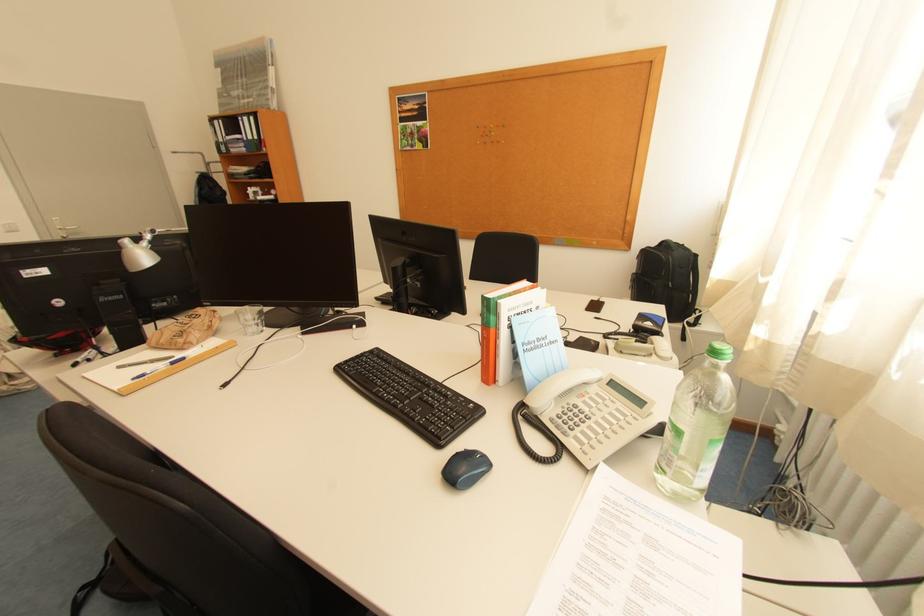
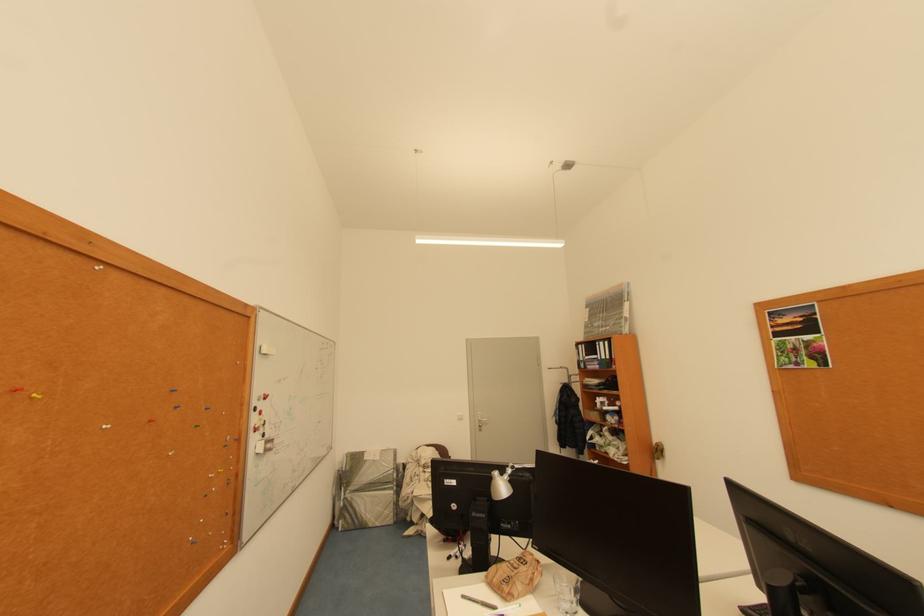
How did the camera likely rotate?

The camera rotated toward left-up.